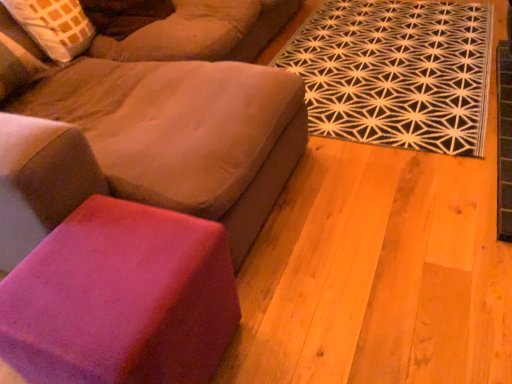
Question: Is suede-like beige studio couch at upper left facing towards black geometric rug at upper right?

Choices:
 (A) no
 (B) yes

Answer: (A)

Question: Considering the relative sizes of suede-like beige studio couch at upper left and black geometric rug at upper right in the image provided, is suede-like beige studio couch at upper left smaller than black geometric rug at upper right?

Choices:
 (A) yes
 (B) no

Answer: (B)

Question: Would you consider suede-like beige studio couch at upper left to be distant from black geometric rug at upper right?

Choices:
 (A) yes
 (B) no

Answer: (B)

Question: Is suede-like beige studio couch at upper left in contact with black geometric rug at upper right?

Choices:
 (A) no
 (B) yes

Answer: (A)

Question: Is suede-like beige studio couch at upper left looking in the opposite direction of black geometric rug at upper right?

Choices:
 (A) no
 (B) yes

Answer: (A)

Question: Is suede-like beige studio couch at upper left at the left side of black geometric rug at upper right?

Choices:
 (A) yes
 (B) no

Answer: (A)

Question: Considering the relative sizes of black geometric rug at upper right and purple suede stool at lower left in the image provided, is black geometric rug at upper right thinner than purple suede stool at lower left?

Choices:
 (A) no
 (B) yes

Answer: (A)

Question: Is black geometric rug at upper right at the right side of purple suede stool at lower left?

Choices:
 (A) no
 (B) yes

Answer: (B)

Question: From a real-world perspective, is black geometric rug at upper right under purple suede stool at lower left?

Choices:
 (A) no
 (B) yes

Answer: (B)

Question: Can you confirm if black geometric rug at upper right is taller than purple suede stool at lower left?

Choices:
 (A) no
 (B) yes

Answer: (A)

Question: Is black geometric rug at upper right next to purple suede stool at lower left?

Choices:
 (A) no
 (B) yes

Answer: (A)

Question: Considering the relative sizes of black geometric rug at upper right and purple suede stool at lower left in the image provided, is black geometric rug at upper right smaller than purple suede stool at lower left?

Choices:
 (A) no
 (B) yes

Answer: (A)

Question: From the image's perspective, is suede-like beige studio couch at upper left on top of purple suede stool at lower left?

Choices:
 (A) yes
 (B) no

Answer: (A)